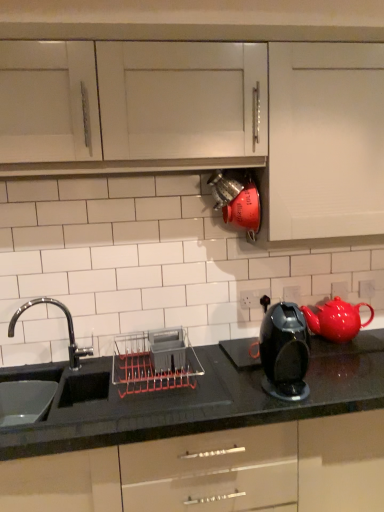
The height and width of the screenshot is (512, 384). I want to click on free space below glossy black coffee maker at center-right (from a real-world perspective), so click(279, 392).